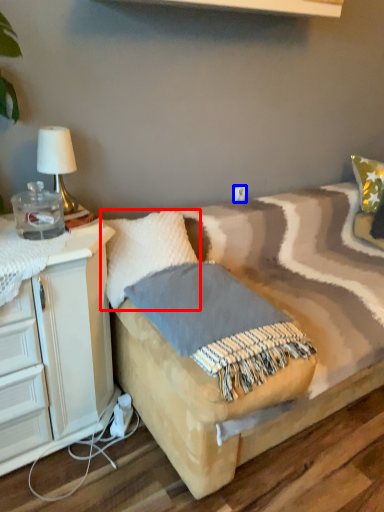
Question: Which point is closer to the camera, pillow (highlighted by a red box) or electric outlet (highlighted by a blue box)?

Choices:
 (A) pillow
 (B) electric outlet

Answer: (A)